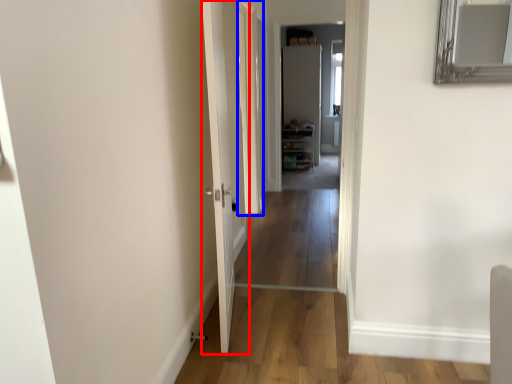
Question: Which object appears closest to the camera in this image, door (highlighted by a red box) or glass door (highlighted by a blue box)?

Choices:
 (A) door
 (B) glass door

Answer: (A)